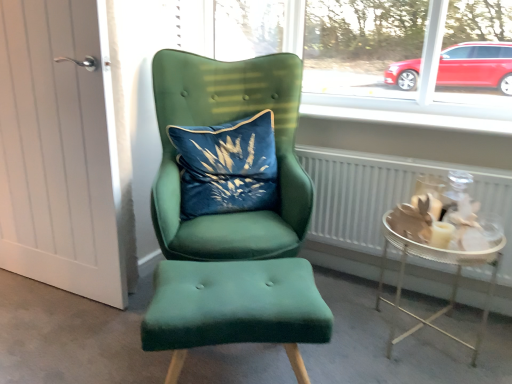
Find the location of a particular element. vacant space underneath white wood door at left (from a real-world perspective) is located at coordinates (56, 284).